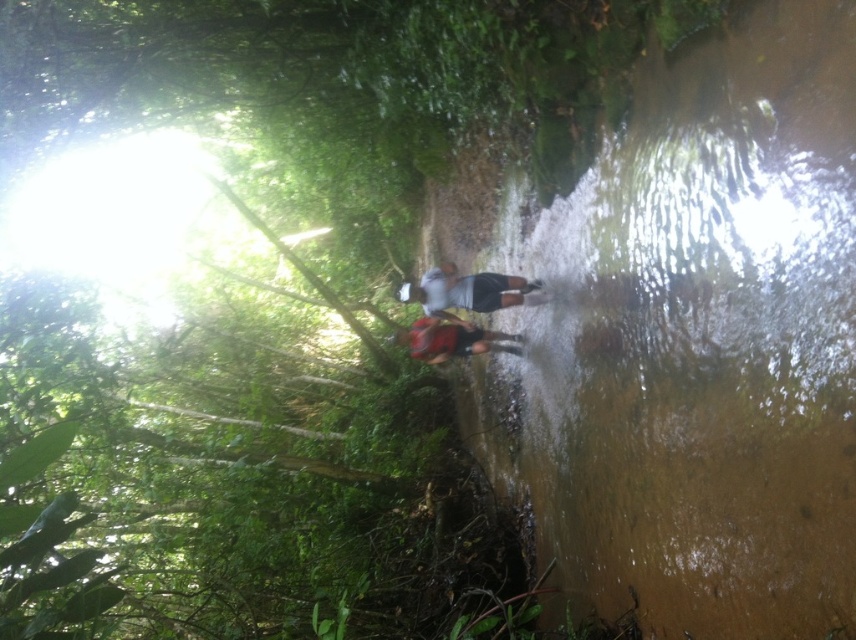
Is gray matte shirt at center to the right of red fabric backpack at center from the viewer's perspective?

Yes, gray matte shirt at center is to the right of red fabric backpack at center.

Does point (406, 291) come in front of point (421, 340)?

Yes.

Locate an element on the screen. Image resolution: width=856 pixels, height=640 pixels. gray matte shirt at center is located at coordinates (468, 291).

Can you confirm if brown murky water at center is wider than red fabric backpack at center?

Incorrect, brown murky water at center's width does not surpass red fabric backpack at center's.

Can you confirm if brown murky water at center is shorter than red fabric backpack at center?

No, brown murky water at center is not shorter than red fabric backpack at center.

Is point (603, 154) positioned after point (434, 355)?

That is False.

The image size is (856, 640). In order to click on brown murky water at center in this screenshot , I will do `click(696, 342)`.

This screenshot has width=856, height=640. Describe the element at coordinates (696, 342) in the screenshot. I see `brown murky water at center` at that location.

Between brown murky water at center and gray matte shirt at center, which one appears on the left side from the viewer's perspective?

gray matte shirt at center is more to the left.

Where is `brown murky water at center`? This screenshot has width=856, height=640. brown murky water at center is located at coordinates (696, 342).